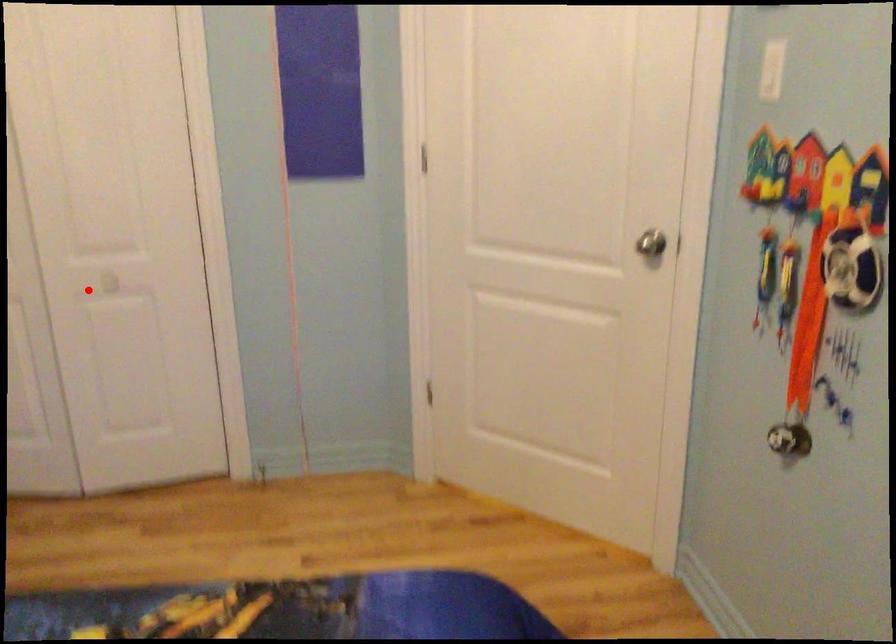
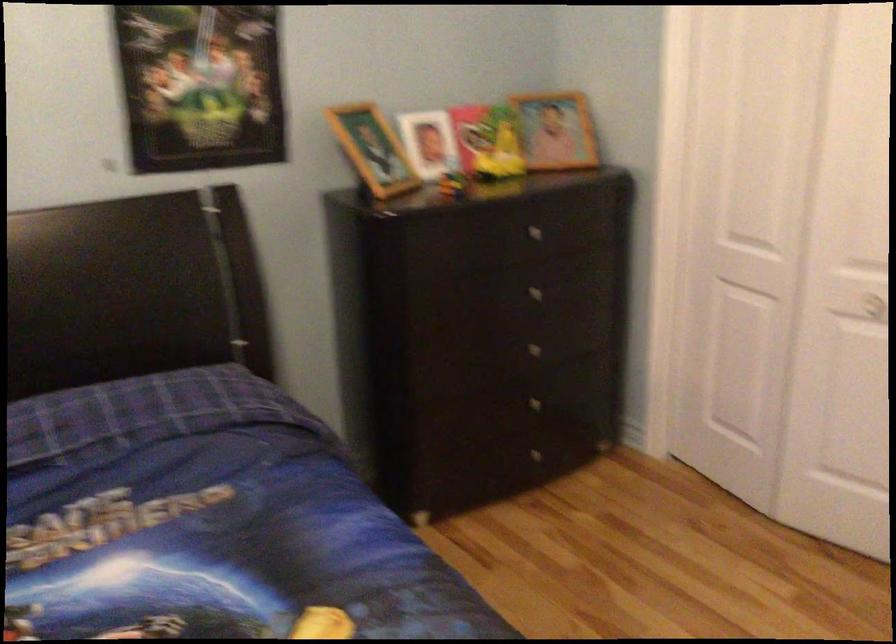
Locate, in the second image, the point that corresponds to the highlighted location in the first image.

(864, 305)